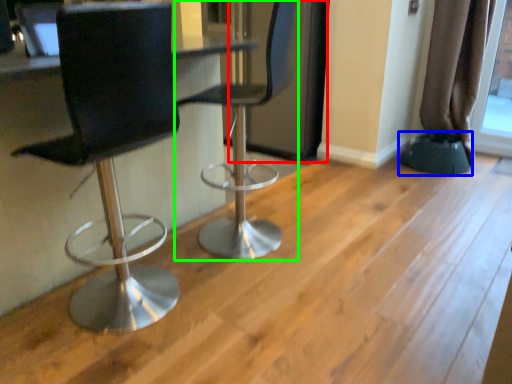
Question: Which object is positioned farthest from screen door (highlighted by a red box)? Select from step stool (highlighted by a blue box) and chair (highlighted by a green box).

Choices:
 (A) step stool
 (B) chair

Answer: (A)